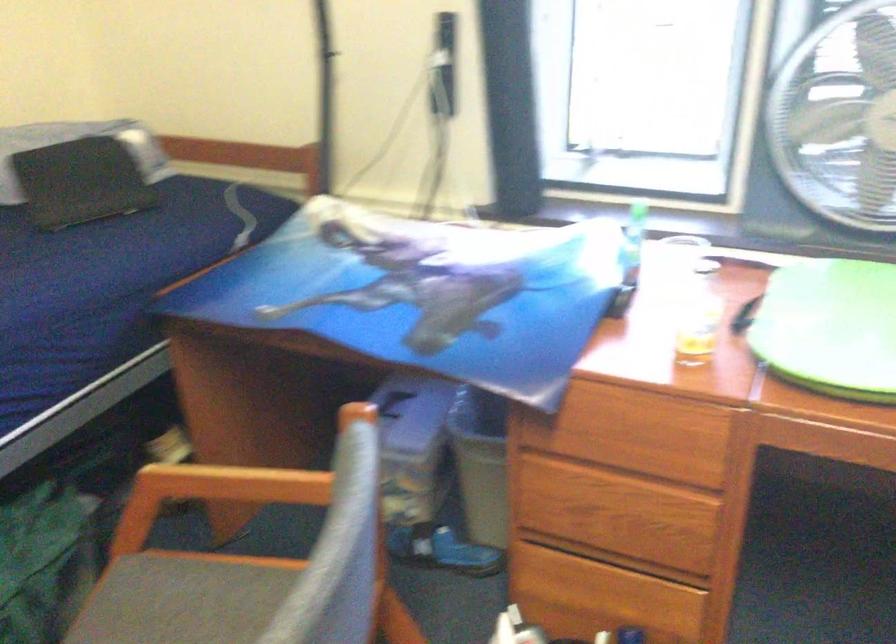
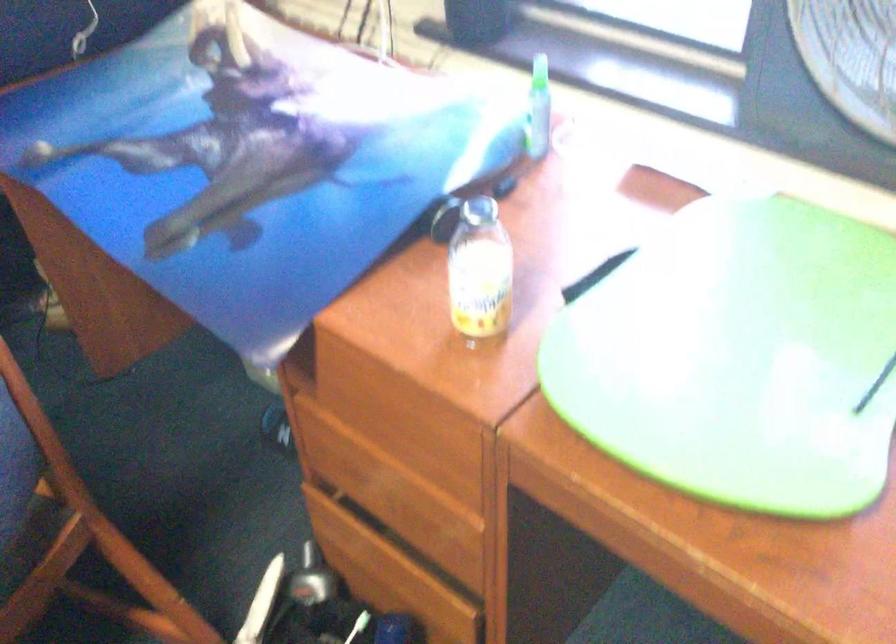
Question: How did the camera likely rotate?

Choices:
 (A) Left
 (B) Right
 (C) Up
 (D) Down

Answer: (D)